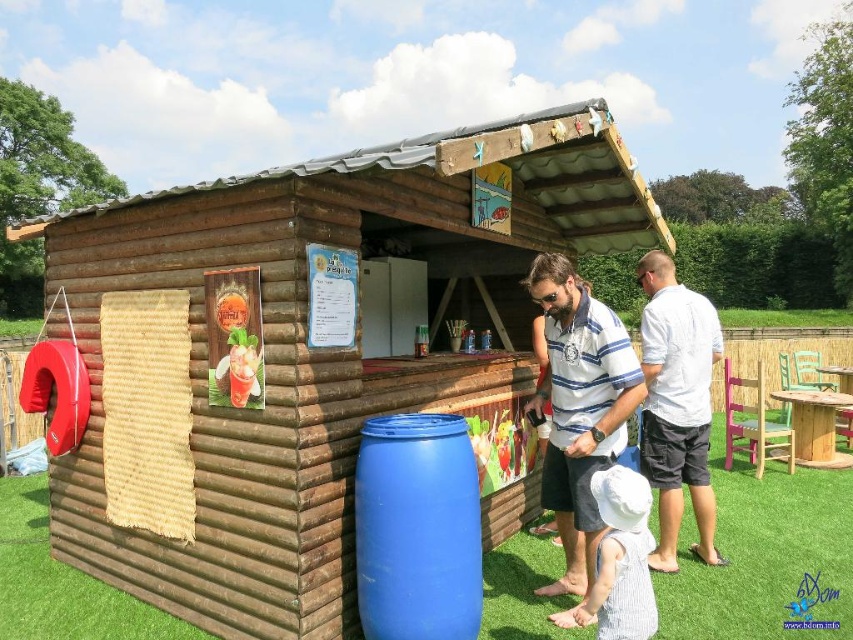
Question: Is blue plastic barrel at center smaller than white striped dress at lower center?

Choices:
 (A) yes
 (B) no

Answer: (B)

Question: Which object is farther from the camera taking this photo?

Choices:
 (A) white cotton shirt at right
 (B) brown wooden log cabin at center
 (C) white striped dress at lower center

Answer: (A)

Question: Can you confirm if blue plastic barrel at center is bigger than white cotton shirt at right?

Choices:
 (A) no
 (B) yes

Answer: (A)

Question: Is blue plastic barrel at center above white striped polo shirt at center?

Choices:
 (A) no
 (B) yes

Answer: (A)

Question: Which point is closer to the camera?

Choices:
 (A) blue plastic barrel at center
 (B) white striped dress at lower center
 (C) brown wooden log cabin at center
 (D) white cotton shirt at right

Answer: (B)

Question: Which object is the closest to the white cotton shirt at right?

Choices:
 (A) brown wooden log cabin at center
 (B) white striped polo shirt at center
 (C) blue plastic barrel at center

Answer: (B)